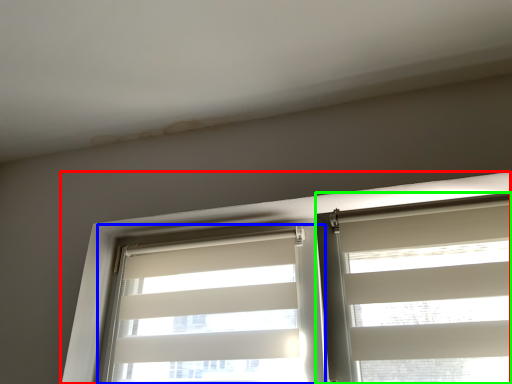
Question: Which object is the closest to the window (highlighted by a red box)? Choose among these: window blind (highlighted by a blue box) or window blind (highlighted by a green box).

Choices:
 (A) window blind
 (B) window blind

Answer: (A)